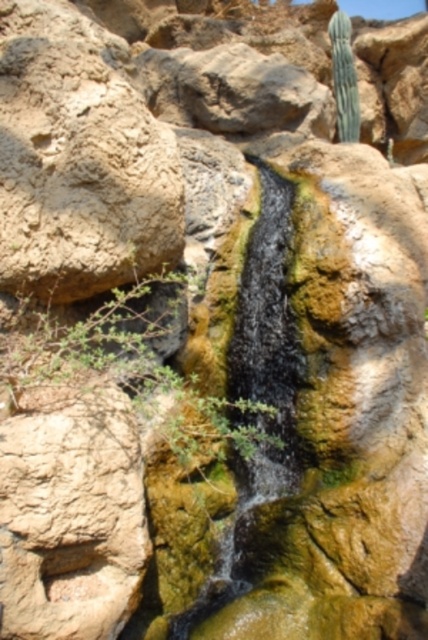
Which is above, green leafy shrub at center or green spiky cactus at upper right?

green spiky cactus at upper right is above.

Does green leafy shrub at center come in front of green spiky cactus at upper right?

That is True.

Is point (198, 448) farther from viewer compared to point (347, 26)?

No, (198, 448) is in front of (347, 26).

The image size is (428, 640). I want to click on green leafy shrub at center, so click(130, 365).